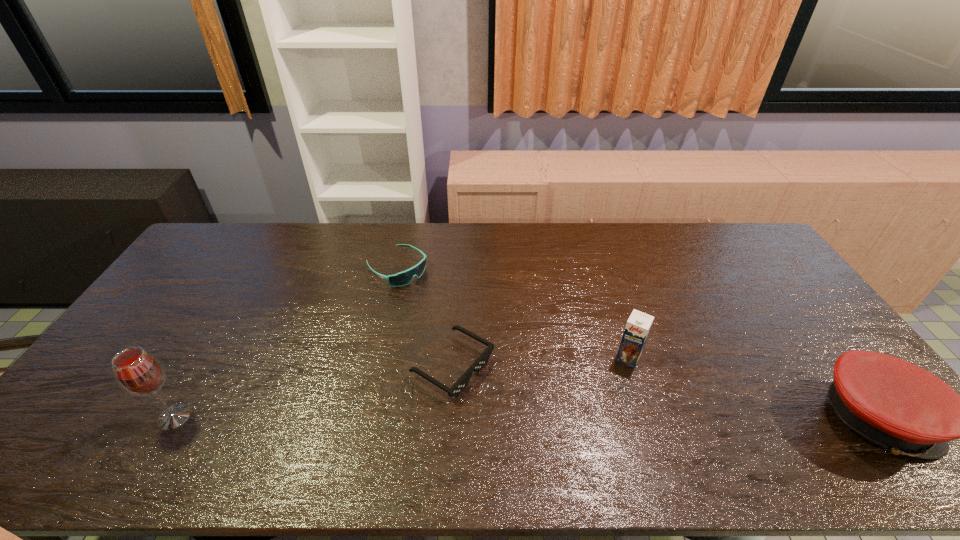
Image resolution: width=960 pixels, height=540 pixels. What are the coordinates of `vacant region at the far edge of the desktop` in the screenshot? It's located at [x=531, y=231].

You are a GUI agent. You are given a task and a screenshot of the screen. Output one action in this format:
    pyautogui.click(x=<x>, y=<y>)
    Task: Click on the free space at the near edge of the desktop
    
    Given the screenshot: What is the action you would take?
    pyautogui.click(x=470, y=399)

The image size is (960, 540). What are the coordinates of `free space at the left edge` in the screenshot? It's located at (180, 295).

In the image, there is a desktop. Identify the location of free space at the far left corner. (191, 257).

This screenshot has width=960, height=540. Find the location of `vacant area between the chocolate milk and the leftmost object`. vacant area between the chocolate milk and the leftmost object is located at coordinates (401, 387).

You are a GUI agent. You are given a task and a screenshot of the screen. Output one action in this format:
    pyautogui.click(x=<x>, y=<y>)
    Task: Click on the free space between the second tallest object and the leftmost object
    
    Given the screenshot: What is the action you would take?
    pyautogui.click(x=401, y=387)

Where is `free space between the chocolate milk and the tallest object`? This screenshot has height=540, width=960. free space between the chocolate milk and the tallest object is located at coordinates (401, 387).

Locate an element on the screen. The height and width of the screenshot is (540, 960). blank region between the nearer sunglasses and the farther sunglasses is located at coordinates (424, 317).

In order to click on vacant point located between the fourth shortest object and the fourth tallest object in this screenshot , I will do `click(513, 313)`.

Locate an element on the screen. vacant space that is in between the wineglass and the shortest object is located at coordinates (314, 392).